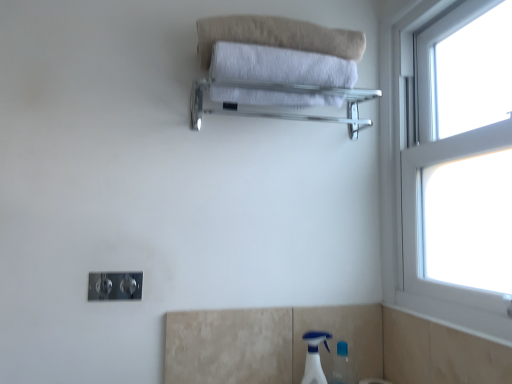
Question: Is beige cotton towel at upper center spatially inside white plastic spray bottle at lower right, or outside of it?

Choices:
 (A) outside
 (B) inside

Answer: (A)

Question: Is point (309, 28) positioned closer to the camera than point (311, 375)?

Choices:
 (A) farther
 (B) closer

Answer: (B)

Question: Considering the real-world distances, which object is farthest from the beige cotton towel at upper center?

Choices:
 (A) clear glass towel rack at upper center
 (B) white plastic spray bottle at lower right
 (C) white soft towel at upper center
 (D) white plastic window at right

Answer: (B)

Question: Which is nearer to the white plastic spray bottle at lower right?

Choices:
 (A) white plastic window at right
 (B) beige cotton towel at upper center
 (C) clear glass towel rack at upper center
 (D) white soft towel at upper center

Answer: (A)